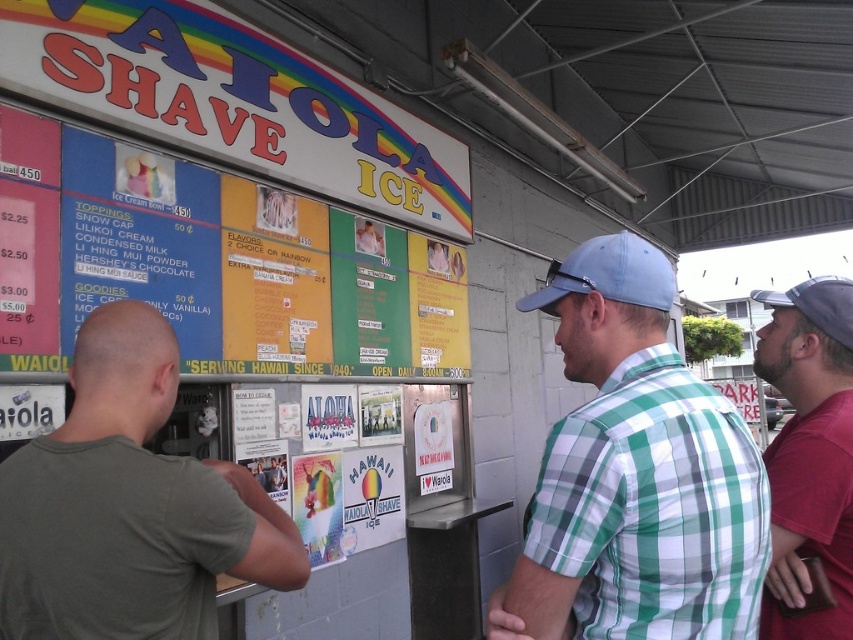
Question: Which point is closer to the camera?

Choices:
 (A) (170, 225)
 (B) (21, 552)
 (C) (811, 310)

Answer: (B)

Question: Is colorful paper menu at upper left wider than green checkered shirt at center?

Choices:
 (A) no
 (B) yes

Answer: (B)

Question: Which object is positioned closest to the green checkered shirt at center?

Choices:
 (A) green matte t-shirt at left
 (B) dark red shirt at right
 (C) matte paper poster at center
 (D) colorful paper menu at upper left

Answer: (B)

Question: Is the position of green matte t-shirt at left less distant than that of matte paper poster at center?

Choices:
 (A) no
 (B) yes

Answer: (B)

Question: Based on their relative distances, which object is nearer to the green matte t-shirt at left?

Choices:
 (A) green checkered shirt at center
 (B) black fabric baseball cap at right
 (C) dark red shirt at right
 (D) matte paper poster at center

Answer: (A)

Question: Does colorful paper menu at upper left appear on the left side of matte paper poster at center?

Choices:
 (A) yes
 (B) no

Answer: (A)